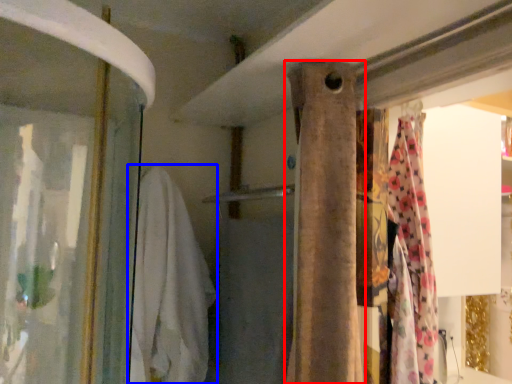
Question: Which object is further to the camera taking this photo, curtain (highlighted by a red box) or clothing (highlighted by a blue box)?

Choices:
 (A) curtain
 (B) clothing

Answer: (B)